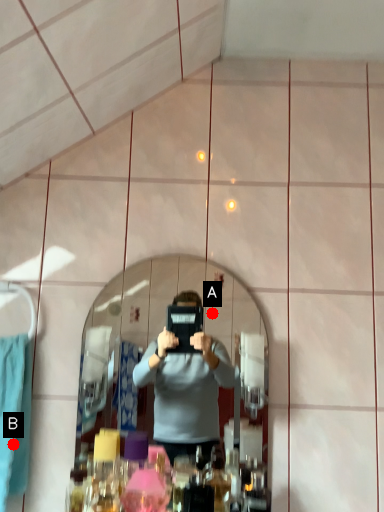
Question: Two points are circled on the image, labeled by A and B beside each circle. Which point appears closest to the camera in this image?

Choices:
 (A) A is closer
 (B) B is closer

Answer: (B)